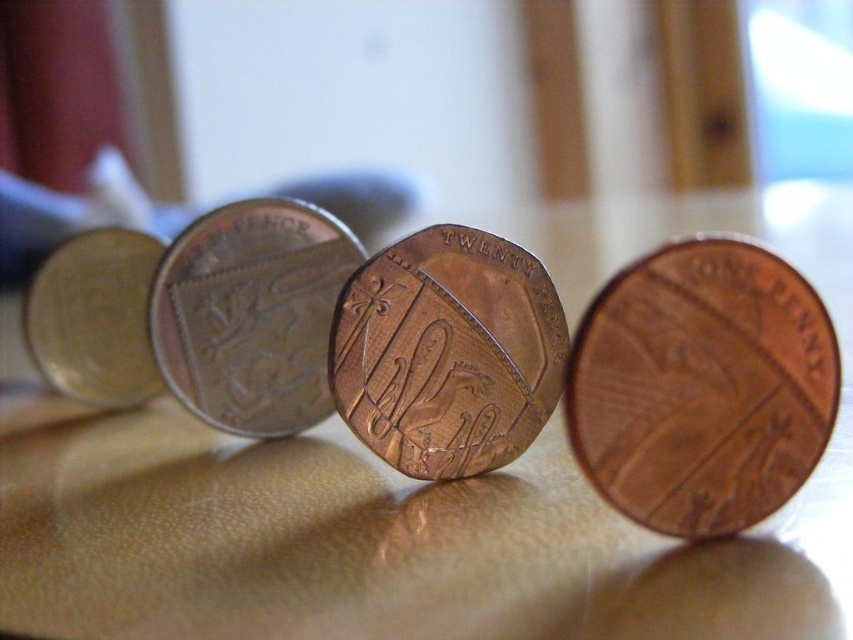
Which is behind, point (543, 273) or point (233, 426)?

Positioned behind is point (233, 426).

Does copper-bronze coin at center have a smaller size compared to bronze/copper coin at center?

Actually, copper-bronze coin at center might be larger than bronze/copper coin at center.

The width and height of the screenshot is (853, 640). What do you see at coordinates (447, 353) in the screenshot?
I see `copper-bronze coin at center` at bounding box center [447, 353].

At what (x,y) coordinates should I click in order to perform the action: click on copper-bronze coin at center. Please return your answer as a coordinate pair (x, y). This screenshot has width=853, height=640. Looking at the image, I should click on (447, 353).

Which of these two, copper/brass penny at right or copper-bronze coin at center, stands shorter?

copper/brass penny at right

Where is `copper/brass penny at right`? The height and width of the screenshot is (640, 853). copper/brass penny at right is located at coordinates (701, 387).

Is copper/brass penny at right taller than bronze/copper coin at center?

In fact, copper/brass penny at right may be shorter than bronze/copper coin at center.

Measure the distance from copper/brass penny at right to bronze/copper coin at center.

copper/brass penny at right is 23.20 inches from bronze/copper coin at center.

Who is more distant from viewer, (727,262) or (199,220)?

Positioned behind is point (199,220).

Identify the location of copper/brass penny at right. (701, 387).